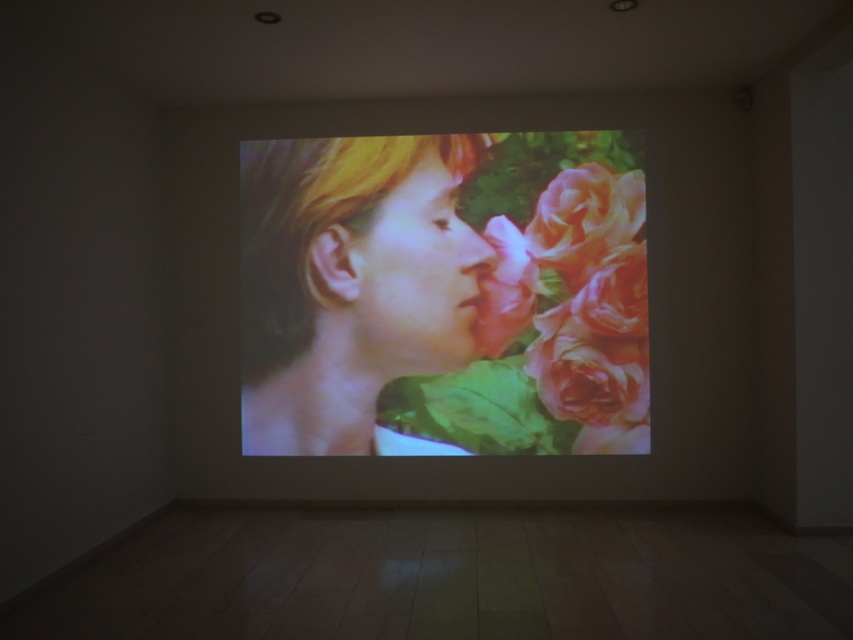
Question: Which point is farther to the camera?

Choices:
 (A) (622, 260)
 (B) (357, 257)

Answer: (B)

Question: Can you confirm if smooth skin face at center is wider than pink matte rose at center?

Choices:
 (A) yes
 (B) no

Answer: (A)

Question: Is smooth skin face at center wider than pink matte rose at center?

Choices:
 (A) yes
 (B) no

Answer: (A)

Question: Which object is the closest to the pink silky rose at center?

Choices:
 (A) pink matte rose at center
 (B) smooth skin face at center

Answer: (A)

Question: Which of the following is the farthest from the observer?

Choices:
 (A) (555, 416)
 (B) (360, 140)
 (C) (618, 211)

Answer: (B)

Question: Does pink matte rose at center have a greater width compared to pink silky rose at center?

Choices:
 (A) yes
 (B) no

Answer: (A)